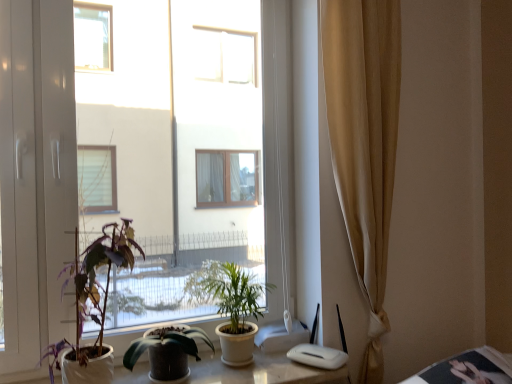
Question: Is green leafy plant at center, which ranks as the 1th houseplant in right-to-left order, shorter than purple matte plant at left, acting as the 3th houseplant starting from the right?

Choices:
 (A) no
 (B) yes

Answer: (B)

Question: From a real-world perspective, is green leafy plant at center, which ranks as the 1th houseplant in right-to-left order, positioned under purple matte plant at left, arranged as the first houseplant when viewed from the left, based on gravity?

Choices:
 (A) no
 (B) yes

Answer: (B)

Question: Can you confirm if green leafy plant at center, which ranks as the 1th houseplant in right-to-left order, is smaller than purple matte plant at left, arranged as the first houseplant when viewed from the left?

Choices:
 (A) yes
 (B) no

Answer: (A)

Question: Could you tell me if green leafy plant at center, arranged as the 3th houseplant when viewed from the left, is facing purple matte plant at left, arranged as the first houseplant when viewed from the left?

Choices:
 (A) no
 (B) yes

Answer: (A)

Question: Can you confirm if green leafy plant at center, arranged as the 3th houseplant when viewed from the left, is positioned to the left of purple matte plant at left, acting as the 3th houseplant starting from the right?

Choices:
 (A) yes
 (B) no

Answer: (B)

Question: Is green leafy plant at center, which ranks as the 1th houseplant in right-to-left order, beside purple matte plant at left, acting as the 3th houseplant starting from the right?

Choices:
 (A) yes
 (B) no

Answer: (B)

Question: Does white glossy table at lower right have a larger size compared to green leafy plant at center, which ranks as the 1th houseplant in right-to-left order?

Choices:
 (A) no
 (B) yes

Answer: (B)

Question: Can you confirm if white glossy table at lower right is shorter than green leafy plant at center, arranged as the 3th houseplant when viewed from the left?

Choices:
 (A) no
 (B) yes

Answer: (B)

Question: Is white glossy table at lower right far away from green leafy plant at center, which ranks as the 1th houseplant in right-to-left order?

Choices:
 (A) yes
 (B) no

Answer: (B)

Question: Is white glossy table at lower right to the left of green leafy plant at center, which ranks as the 1th houseplant in right-to-left order, from the viewer's perspective?

Choices:
 (A) no
 (B) yes

Answer: (A)

Question: Is white glossy table at lower right beside green leafy plant at center, arranged as the 3th houseplant when viewed from the left?

Choices:
 (A) no
 (B) yes

Answer: (A)

Question: Can you confirm if white glossy table at lower right is wider than green leafy plant at center, arranged as the 3th houseplant when viewed from the left?

Choices:
 (A) yes
 (B) no

Answer: (A)

Question: Is green leafy plant at center, which ranks as the 1th houseplant in right-to-left order, outside of transparent glass window at center?

Choices:
 (A) yes
 (B) no

Answer: (B)